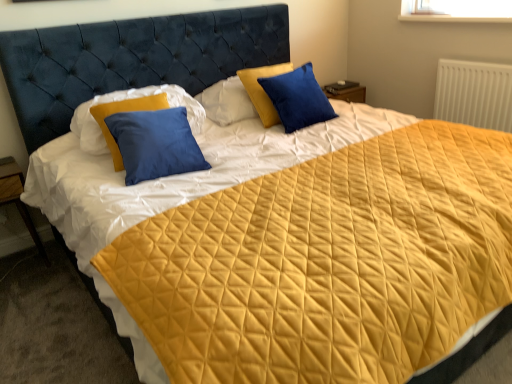
Question: Does matte blue pillow at center, the second pillow from the right, appear on the right side of wooden at left?

Choices:
 (A) yes
 (B) no

Answer: (A)

Question: Is matte blue pillow at center, which is the first pillow from left to right, oriented away from wooden at left?

Choices:
 (A) no
 (B) yes

Answer: (A)

Question: Considering the relative sizes of matte blue pillow at center, the second pillow from the right, and wooden at left in the image provided, is matte blue pillow at center, the second pillow from the right, wider than wooden at left?

Choices:
 (A) yes
 (B) no

Answer: (B)

Question: Is matte blue pillow at center, the second pillow from the right, positioned before wooden at left?

Choices:
 (A) no
 (B) yes

Answer: (B)

Question: From the image's perspective, is matte blue pillow at center, the second pillow from the right, under wooden at left?

Choices:
 (A) no
 (B) yes

Answer: (A)

Question: Considering the relative positions of white textured radiator at upper right and blue velvet pillow at upper center, which is counted as the second pillow, starting from the left, in the image provided, is white textured radiator at upper right to the left or to the right of blue velvet pillow at upper center, which is counted as the second pillow, starting from the left,?

Choices:
 (A) left
 (B) right

Answer: (B)

Question: Is point (481, 100) closer or farther from the camera than point (303, 107)?

Choices:
 (A) closer
 (B) farther

Answer: (B)

Question: In the image, is white textured radiator at upper right positioned in front of or behind blue velvet pillow at upper center, which ranks as the 1th pillow in right-to-left order?

Choices:
 (A) behind
 (B) front

Answer: (A)

Question: Looking at their shapes, would you say white textured radiator at upper right is wider or thinner than blue velvet pillow at upper center, which ranks as the 1th pillow in right-to-left order?

Choices:
 (A) wide
 (B) thin

Answer: (B)

Question: Is blue velvet pillow at upper center, which is counted as the second pillow, starting from the left, wider or thinner than wooden at left?

Choices:
 (A) thin
 (B) wide

Answer: (A)

Question: Relative to wooden at left, is blue velvet pillow at upper center, which is counted as the second pillow, starting from the left, in front or behind?

Choices:
 (A) front
 (B) behind

Answer: (B)

Question: Considering the positions of point (287, 96) and point (8, 170), is point (287, 96) closer or farther from the camera than point (8, 170)?

Choices:
 (A) closer
 (B) farther

Answer: (B)

Question: Considering the relative positions of blue velvet pillow at upper center, which is counted as the second pillow, starting from the left, and wooden at left in the image provided, is blue velvet pillow at upper center, which is counted as the second pillow, starting from the left, to the left or to the right of wooden at left?

Choices:
 (A) left
 (B) right

Answer: (B)

Question: From the image's perspective, is wooden at left above or below blue velvet pillow at upper center, which ranks as the 1th pillow in right-to-left order?

Choices:
 (A) above
 (B) below

Answer: (B)

Question: From a real-world perspective, is wooden at left above or below blue velvet pillow at upper center, which is counted as the second pillow, starting from the left?

Choices:
 (A) below
 (B) above

Answer: (A)